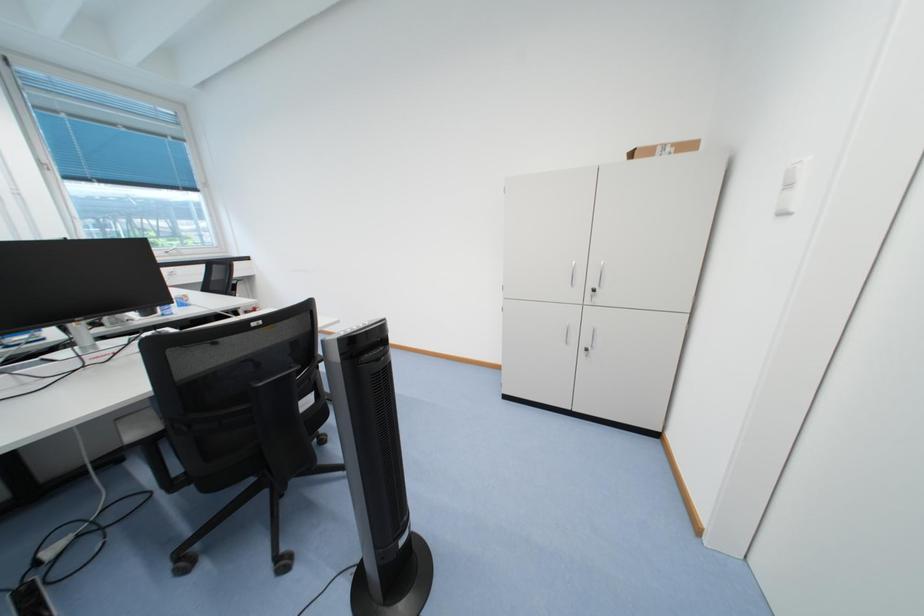
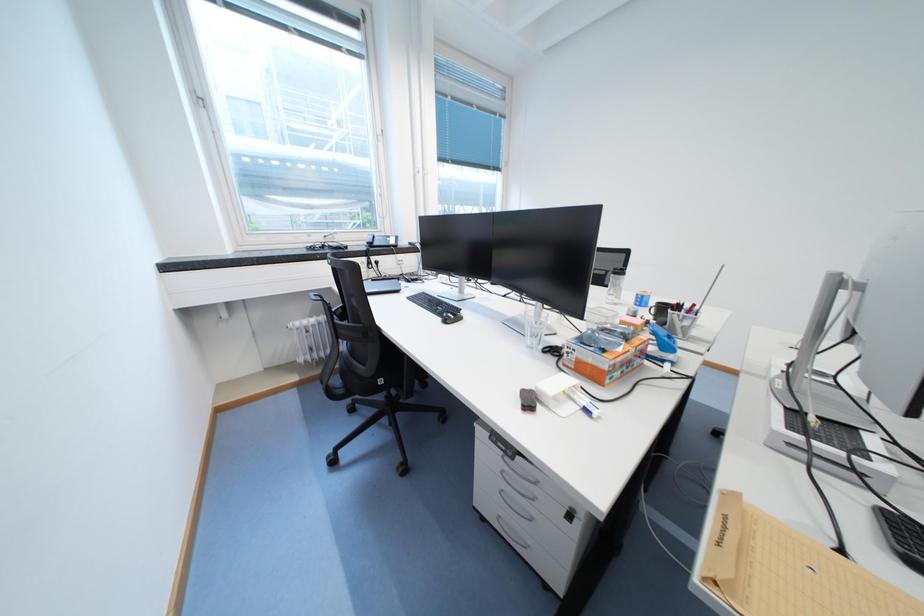
Question: What movement of the cameraman would produce the second image?

Choices:
 (A) Left
 (B) Right
 (C) Forward
 (D) Backward

Answer: (A)